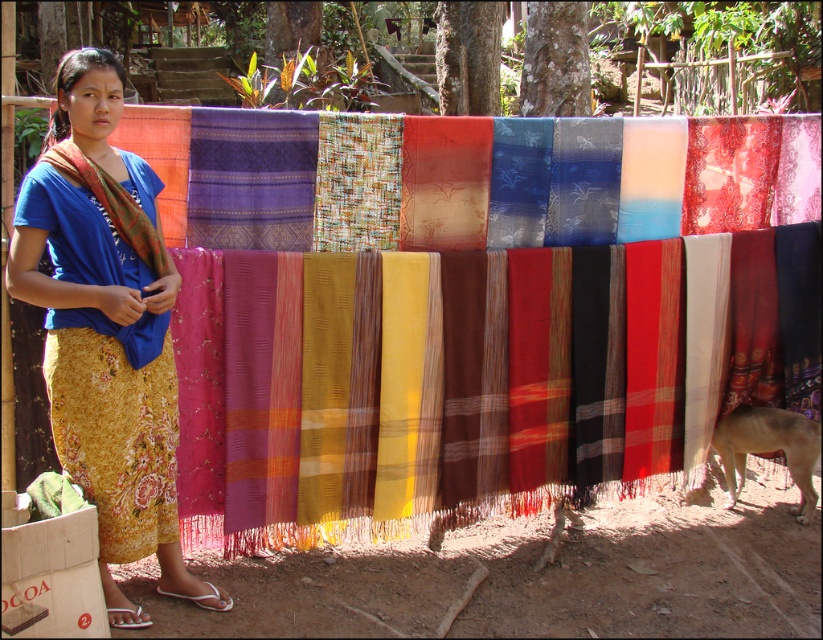
Question: Is matte blue shirt at center below brown fur dog at lower right?

Choices:
 (A) yes
 (B) no

Answer: (B)

Question: Can you confirm if matte woven cloth at center is smaller than matte orange shawl at left?

Choices:
 (A) yes
 (B) no

Answer: (B)

Question: Which point appears farthest from the camera in this image?

Choices:
 (A) 803,460
 (B) 463,460

Answer: (A)

Question: Which of the following is the closest to the observer?

Choices:
 (A) brown fur dog at lower right
 (B) matte woven cloth at center
 (C) matte blue shirt at center

Answer: (C)

Question: Which point appears closest to the camera in this image?

Choices:
 (A) (159, 250)
 (B) (733, 484)
 (C) (566, 125)

Answer: (A)

Question: Can you confirm if brown fur dog at lower right is positioned to the right of matte orange shawl at left?

Choices:
 (A) yes
 (B) no

Answer: (A)